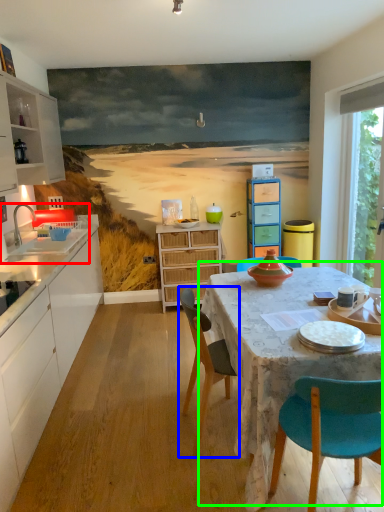
Question: Which object is the closest to the sink (highlighted by a red box)? Choose among these: chair (highlighted by a blue box) or kitchen & dining room table (highlighted by a green box).

Choices:
 (A) chair
 (B) kitchen & dining room table

Answer: (A)